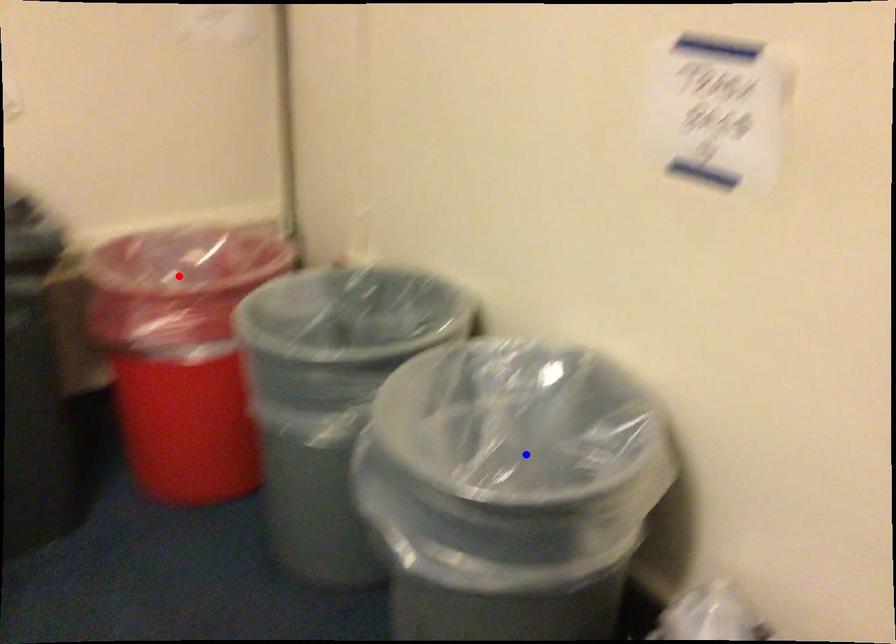
Question: In the image, two points are highlighted. Which point is nearer to the camera? Reply with the corresponding letter.

Choices:
 (A) blue point
 (B) red point

Answer: (A)